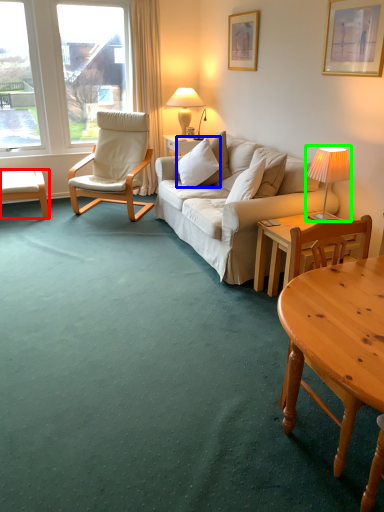
Question: Which object is positioned closest to desk (highlighted by a red box)? Select from pillow (highlighted by a blue box) and lamp (highlighted by a green box).

Choices:
 (A) pillow
 (B) lamp

Answer: (A)